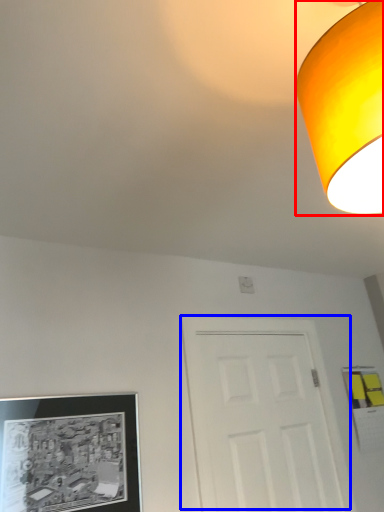
Question: Which object is further to the camera taking this photo, lamp (highlighted by a red box) or door (highlighted by a blue box)?

Choices:
 (A) lamp
 (B) door

Answer: (B)